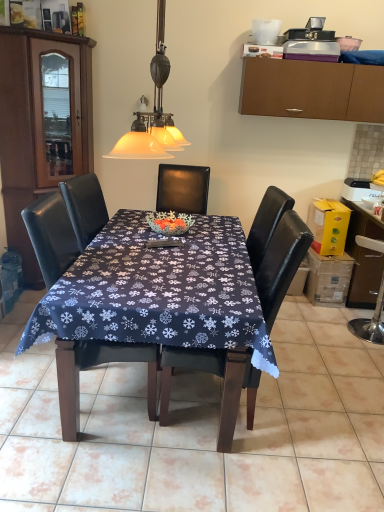
Image resolution: width=384 pixels, height=512 pixels. I want to click on vacant space to the right of dark blue fabric tablecloth at center, so point(328,379).